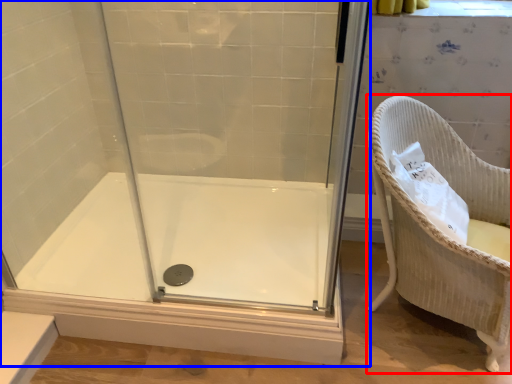
Question: Which point is closer to the camera, furniture (highlighted by a red box) or shower door (highlighted by a blue box)?

Choices:
 (A) furniture
 (B) shower door

Answer: (B)